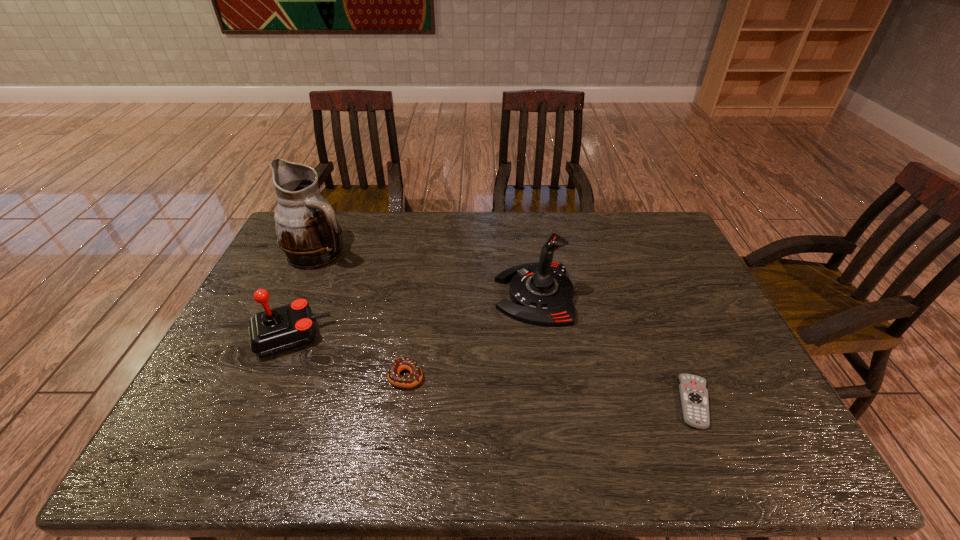
What are the coordinates of `pitcher` in the screenshot? It's located at (308, 233).

Image resolution: width=960 pixels, height=540 pixels. Find the location of `the fourth shortest object`. the fourth shortest object is located at coordinates (541, 293).

Where is `the right joystick`? This screenshot has width=960, height=540. the right joystick is located at coordinates (541, 293).

In order to click on the left joystick in this screenshot , I will do `click(272, 331)`.

Image resolution: width=960 pixels, height=540 pixels. Identify the location of the shorter joystick. (272, 331).

Where is `doughnut`? This screenshot has width=960, height=540. doughnut is located at coordinates (397, 366).

I want to click on the fourth tallest object, so click(397, 366).

Locate an element on the screen. the rightmost object is located at coordinates (694, 395).

This screenshot has height=540, width=960. Find the location of `the shortest object`. the shortest object is located at coordinates (694, 395).

Locate an element on the screen. This screenshot has width=960, height=540. vacant region located 0.350m from the spout of the pitcher is located at coordinates (457, 253).